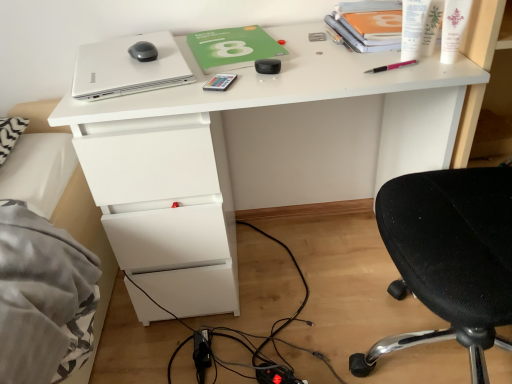
Find the location of a particular element. This screenshot has width=512, height=384. free location above silver metallic laptop at upper left (from a real-world perspective) is located at coordinates (126, 57).